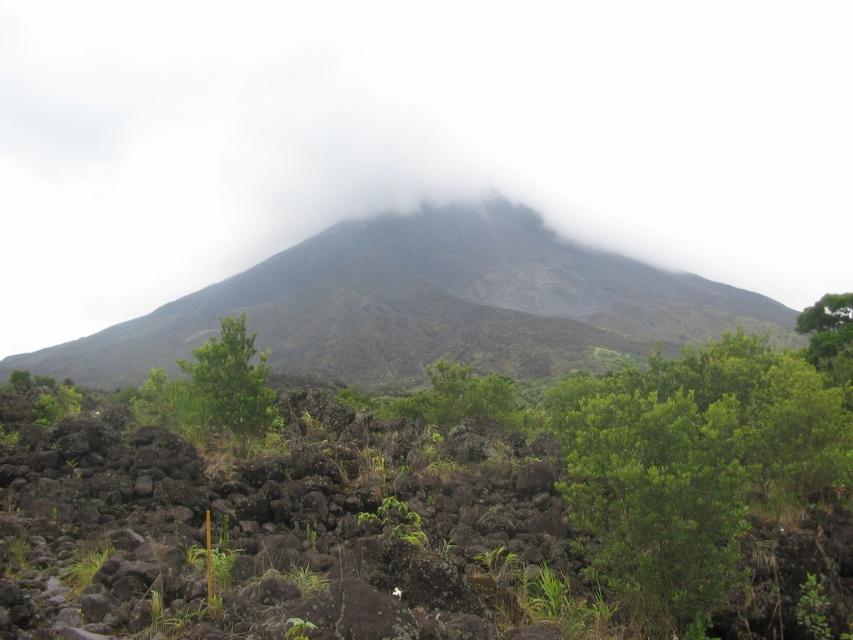
Is green leafy tree at center wider than green leafy tree at upper right?

Incorrect, green leafy tree at center's width does not surpass green leafy tree at upper right's.

The height and width of the screenshot is (640, 853). Describe the element at coordinates (231, 381) in the screenshot. I see `green leafy tree at center` at that location.

At what (x,y) coordinates should I click in order to perform the action: click on green leafy tree at center. Please return your answer as a coordinate pair (x, y). This screenshot has width=853, height=640. Looking at the image, I should click on (231, 381).

Is dark gray rocky mountain at center to the right of green leafy tree at upper right from the viewer's perspective?

No, dark gray rocky mountain at center is not to the right of green leafy tree at upper right.

Where is `dark gray rocky mountain at center`? dark gray rocky mountain at center is located at coordinates (427, 305).

Where is `dark gray rocky mountain at center`? The height and width of the screenshot is (640, 853). dark gray rocky mountain at center is located at coordinates (427, 305).

Is dark gray rocky mountain at center taller than green leafy bush at center?

Yes, dark gray rocky mountain at center is taller than green leafy bush at center.

Looking at this image, between dark gray rocky mountain at center and green leafy bush at center, which one is positioned lower?

green leafy bush at center

Is point (735, 320) in front of point (717, 563)?

That is False.

The image size is (853, 640). What are the coordinates of `dark gray rocky mountain at center` in the screenshot? It's located at (427, 305).